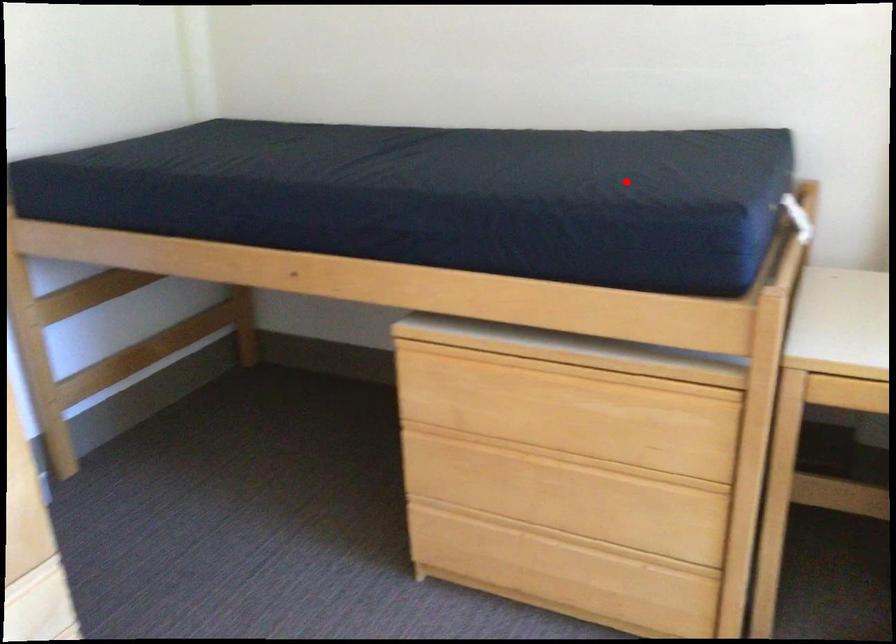
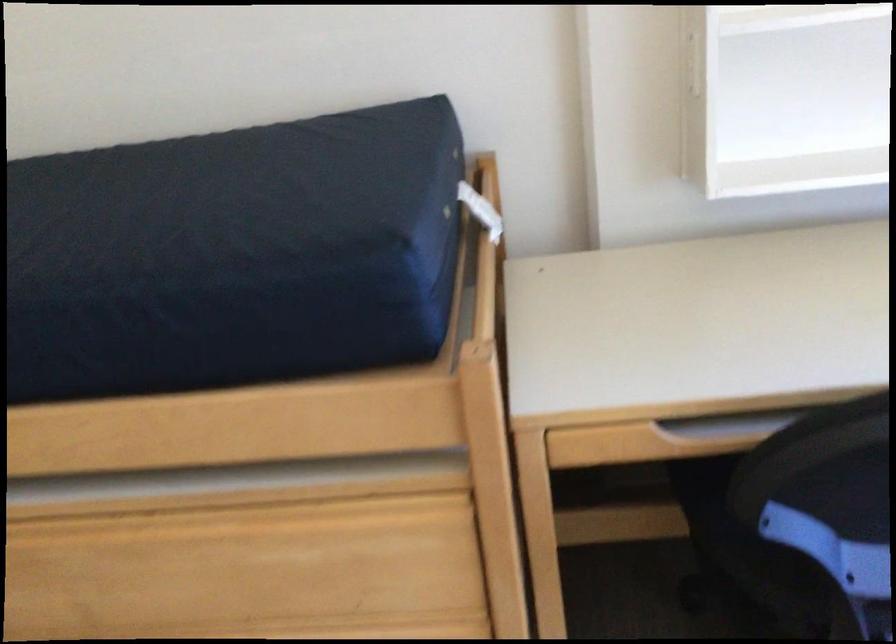
Question: I am providing you with two images of the same scene from different viewpoints. In image1, a red point is highlighted. Considering the same 3D point in image2, which of the following is correct?

Choices:
 (A) It is closer
 (B) It is farther

Answer: (A)